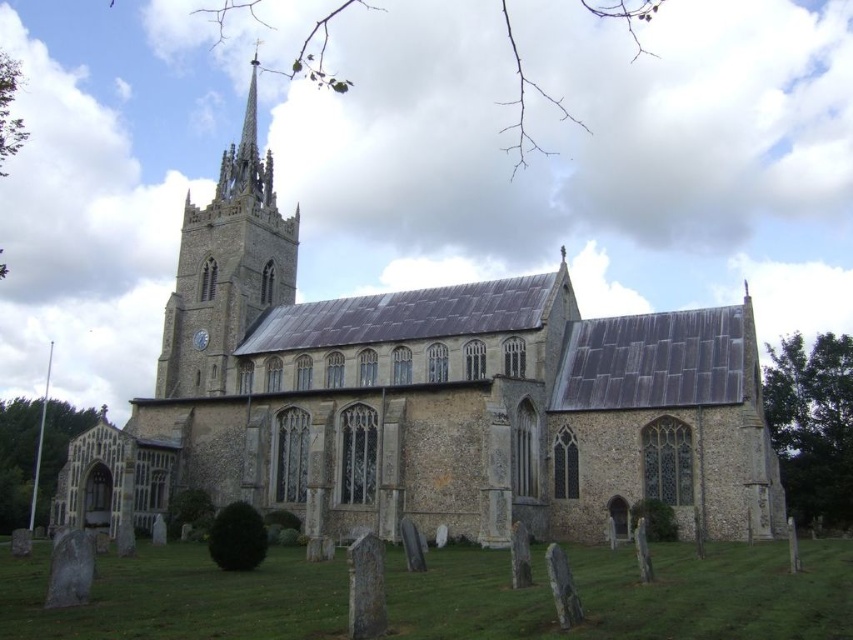
Who is taller, stone church at center or smooth stone tower at center?

With more height is stone church at center.

Is stone church at center to the right of smooth stone tower at center from the viewer's perspective?

Correct, you'll find stone church at center to the right of smooth stone tower at center.

Based on the photo, who is more distant from viewer, (231,257) or (198,353)?

The point (231,257) is more distant.

The height and width of the screenshot is (640, 853). What are the coordinates of `stone church at center` in the screenshot? It's located at (425, 397).

Does smooth stone tower at center have a lesser width compared to dark gray stone gravestone at lower center?

No, smooth stone tower at center is not thinner than dark gray stone gravestone at lower center.

Is smooth stone tower at center to the left of dark gray stone gravestone at lower center from the viewer's perspective?

Correct, you'll find smooth stone tower at center to the left of dark gray stone gravestone at lower center.

Between point (207, 353) and point (369, 547), which one is positioned behind?

Positioned behind is point (207, 353).

Find the location of a particular element. Image resolution: width=853 pixels, height=640 pixels. smooth stone tower at center is located at coordinates point(225,268).

Find the location of a particular element. The image size is (853, 640). stone church at center is located at coordinates (425, 397).

Between point (659, 392) and point (82, 550), which one is positioned in front?

Point (82, 550) is in front.

The height and width of the screenshot is (640, 853). I want to click on stone church at center, so click(425, 397).